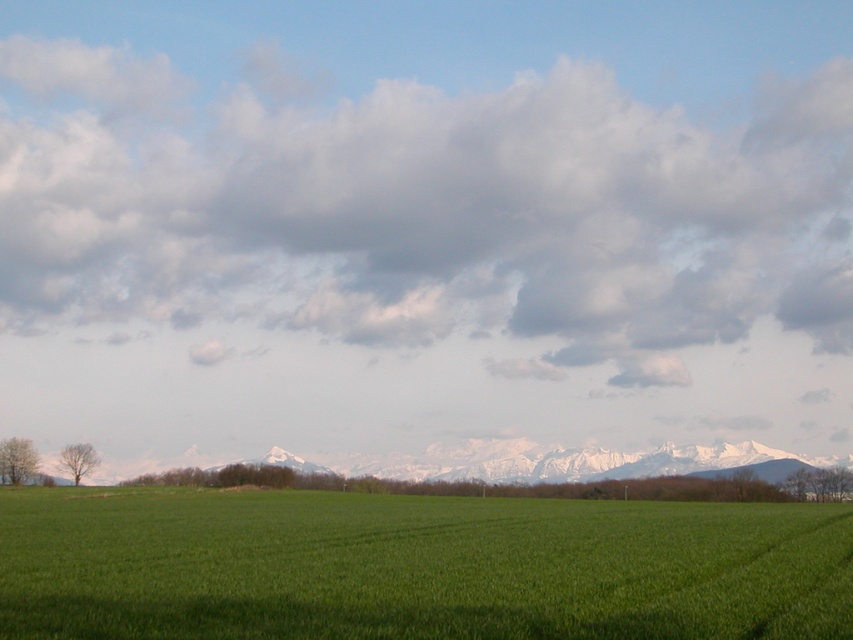
Can you confirm if cloudy sky at upper center is thinner than white snow-covered mountain range at center?

No.

Between point (132, 202) and point (737, 444), which one is positioned behind?

The point (132, 202) is behind.

The width and height of the screenshot is (853, 640). I want to click on cloudy sky at upper center, so click(427, 212).

Does cloudy sky at upper center appear on the right side of green grass at center?

In fact, cloudy sky at upper center is to the left of green grass at center.

Is point (337, 189) positioned behind point (708, 611)?

Yes, point (337, 189) is farther from viewer.

I want to click on cloudy sky at upper center, so click(x=427, y=212).

Who is positioned more to the right, green grass at center or white snow-covered mountain range at center?

white snow-covered mountain range at center is more to the right.

Does green grass at center appear on the right side of white snow-covered mountain range at center?

No, green grass at center is not to the right of white snow-covered mountain range at center.

Locate an element on the screen. This screenshot has height=640, width=853. green grass at center is located at coordinates point(415,566).

Identify the location of green grass at center. (415, 566).